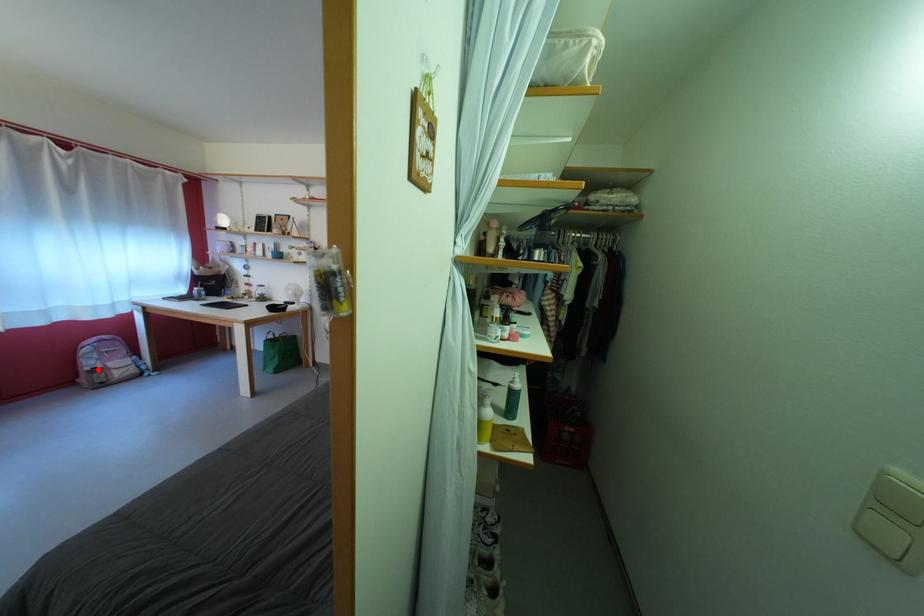
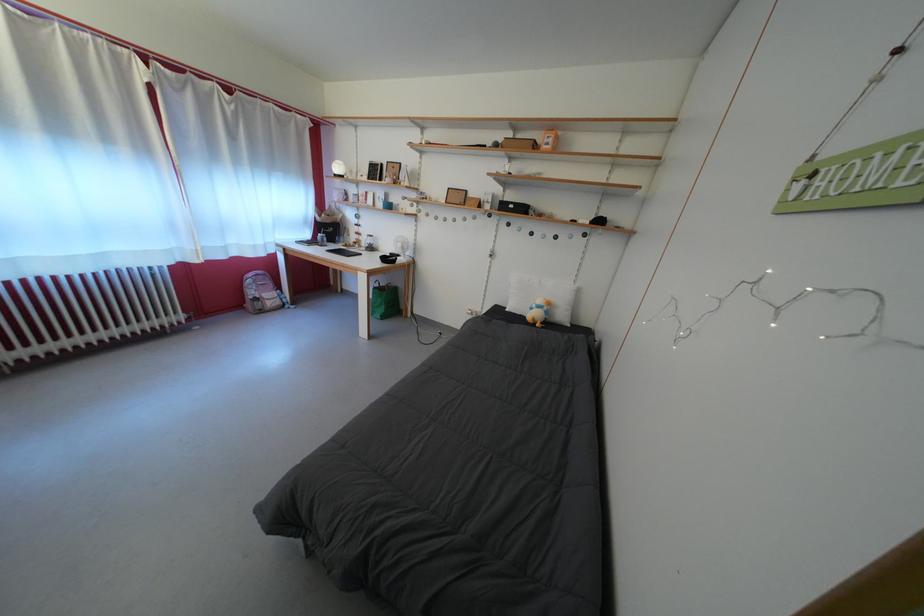
Question: I am providing you with two images of the same scene from different viewpoints. Image1 has a red point marked. In image2, the corresponding 3D location appears at what relative position? Reply with the corresponding letter.

Choices:
 (A) Closer
 (B) Farther

Answer: (A)